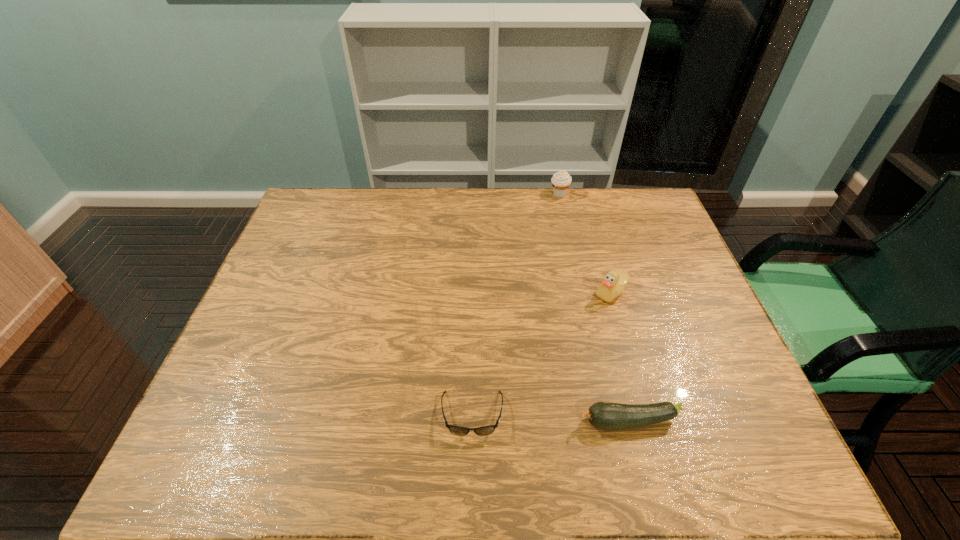
What are the coordinates of `vacant area at the far left corner` in the screenshot? It's located at coord(345,200).

In the image, there is a desktop. Where is `free space at the far right corner`? The width and height of the screenshot is (960, 540). free space at the far right corner is located at coordinates (654, 207).

At what (x,y) coordinates should I click in order to perform the action: click on free area in between the second farthest object and the muffin. Please return your answer as a coordinate pair (x, y). The image size is (960, 540). Looking at the image, I should click on (585, 243).

This screenshot has height=540, width=960. What are the coordinates of `vacant space in between the farthest object and the zucchini` in the screenshot? It's located at (594, 308).

Locate an element on the screen. Image resolution: width=960 pixels, height=540 pixels. empty location between the sunglasses and the zucchini is located at coordinates (550, 418).

Locate an element on the screen. empty location between the zucchini and the shortest object is located at coordinates (550, 418).

Locate an element on the screen. empty space that is in between the second farthest object and the muffin is located at coordinates (585, 243).

You are a GUI agent. You are given a task and a screenshot of the screen. Output one action in this format:
    pyautogui.click(x=<x>, y=<y>)
    Task: Click on the vacant space that is in between the leftmost object and the zucchini
    
    Given the screenshot: What is the action you would take?
    pyautogui.click(x=550, y=418)

Where is `empty space between the farthest object and the sunglasses`? empty space between the farthest object and the sunglasses is located at coordinates (516, 304).

This screenshot has height=540, width=960. I want to click on free spot between the duck and the leftmost object, so click(x=541, y=354).